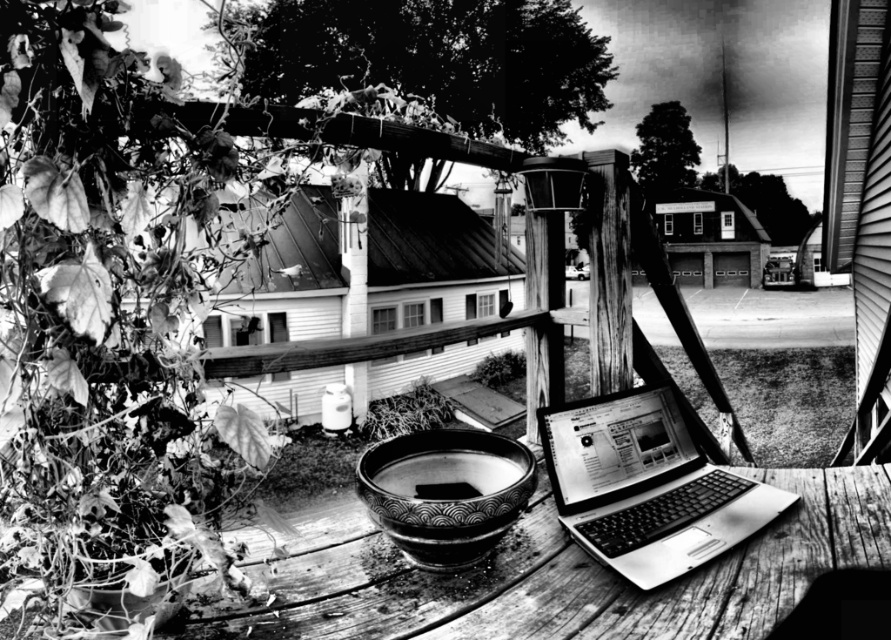
Question: Which point appears farthest from the camera in this image?

Choices:
 (A) (630, 570)
 (B) (464, 532)

Answer: (A)

Question: Which object appears closest to the camera in this image?

Choices:
 (A) patterned ceramic bowl at center
 (B) metallic silver laptop at center

Answer: (A)

Question: Among these objects, which one is farthest from the camera?

Choices:
 (A) metallic silver laptop at center
 (B) patterned ceramic bowl at center

Answer: (A)

Question: Can you confirm if metallic silver laptop at center is positioned above patterned ceramic bowl at center?

Choices:
 (A) yes
 (B) no

Answer: (A)

Question: Considering the relative positions of metallic silver laptop at center and patterned ceramic bowl at center in the image provided, where is metallic silver laptop at center located with respect to patterned ceramic bowl at center?

Choices:
 (A) left
 (B) right

Answer: (B)

Question: Can you confirm if metallic silver laptop at center is smaller than patterned ceramic bowl at center?

Choices:
 (A) yes
 (B) no

Answer: (B)